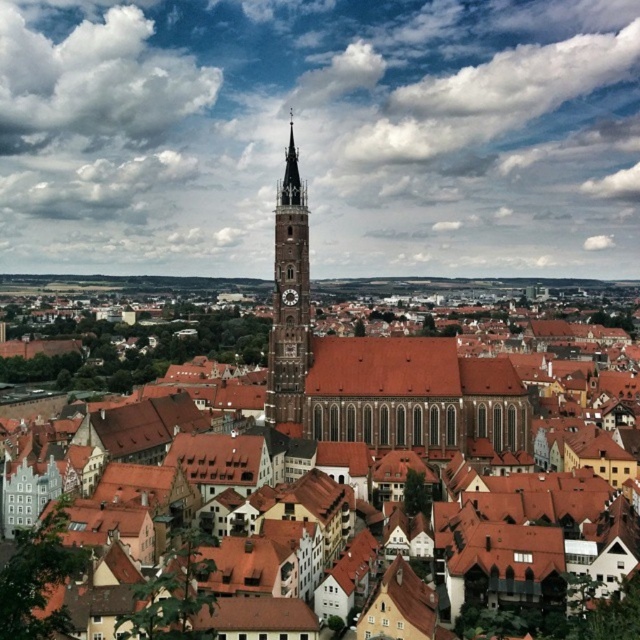
Question: Among these points, which one is farthest from the camera?

Choices:
 (A) (276, 221)
 (B) (192, 310)

Answer: (B)

Question: Does brown stone clock tower at center have a greater width compared to dark brown wooden clock at center?

Choices:
 (A) no
 (B) yes

Answer: (B)

Question: In this image, where is brown tiled roof at center located relative to dark brown wooden clock at center?

Choices:
 (A) left
 (B) right

Answer: (A)

Question: Is brown stone clock tower at center smaller than dark brown wooden clock at center?

Choices:
 (A) yes
 (B) no

Answer: (B)

Question: Which of these objects is positioned farthest from the brown stone clock tower at center?

Choices:
 (A) brown tiled roof at center
 (B) dark brown wooden clock at center

Answer: (A)

Question: Which is nearer to the dark brown wooden clock at center?

Choices:
 (A) brown stone clock tower at center
 (B) brown tiled roof at center

Answer: (A)